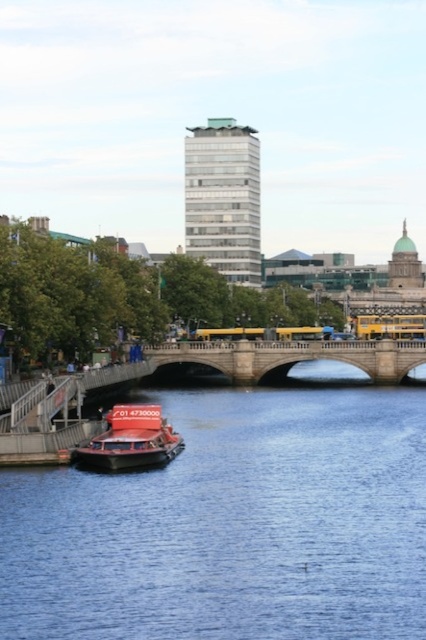
Can you confirm if shiny red boat at lower left is positioned above yellow metallic bus at center?

No.

Can you confirm if shiny red boat at lower left is bigger than yellow metallic bus at center?

Incorrect, shiny red boat at lower left is not larger than yellow metallic bus at center.

Is point (126, 451) farther from viewer compared to point (423, 332)?

No, it is in front of (423, 332).

Where is `shiny red boat at lower left`? shiny red boat at lower left is located at coordinates (131, 440).

Is blue water at center smaller than yellow metallic bus at center?

No.

You are a GUI agent. You are given a task and a screenshot of the screen. Output one action in this format:
    pyautogui.click(x=<x>, y=<y>)
    Task: Click on the blue water at center
    Image resolution: width=426 pixels, height=640 pixels.
    Given the screenshot: What is the action you would take?
    pyautogui.click(x=233, y=522)

Does blue water at center have a smaller size compared to stone bridge at center?

Incorrect, blue water at center is not smaller in size than stone bridge at center.

Does blue water at center have a larger size compared to stone bridge at center?

Yes, blue water at center is bigger than stone bridge at center.

Between point (81, 612) and point (242, 346), which one is positioned in front?

Point (81, 612) is more forward.

The image size is (426, 640). Find the location of `blue water at center`. blue water at center is located at coordinates (233, 522).